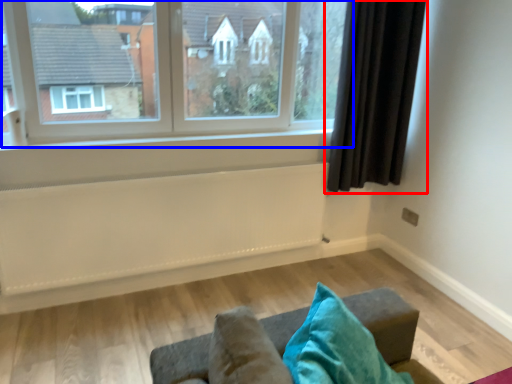
Question: Which object is closer to the camera taking this photo, curtain (highlighted by a red box) or window (highlighted by a blue box)?

Choices:
 (A) curtain
 (B) window

Answer: (B)